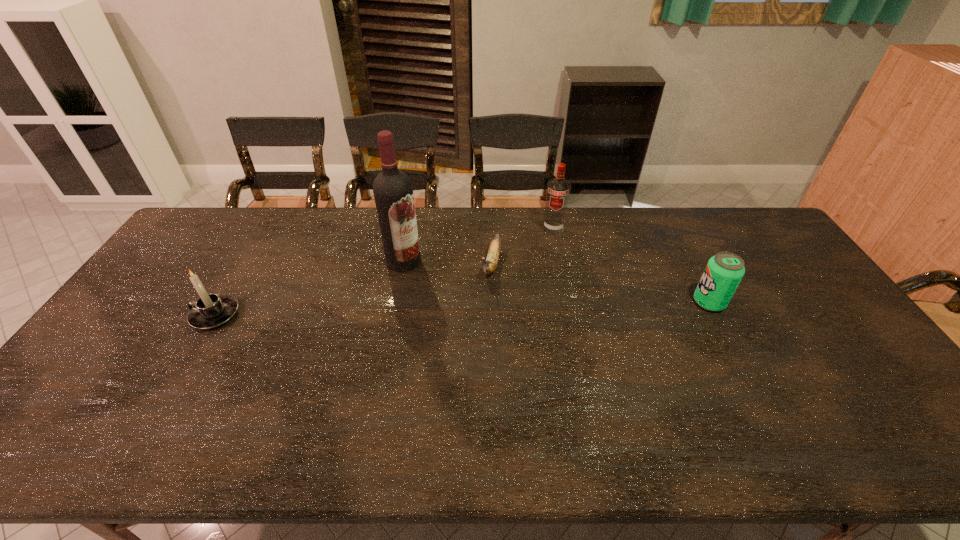
Where is `vacant point located 0.340m on the peel of the shortest object`? This screenshot has width=960, height=540. vacant point located 0.340m on the peel of the shortest object is located at coordinates (461, 372).

Find the location of `vacant region located 0.280m on the peel of the shortest object`. vacant region located 0.280m on the peel of the shortest object is located at coordinates pos(467,354).

The height and width of the screenshot is (540, 960). Find the location of `vacant space located 0.260m on the peel of the shortest object`. vacant space located 0.260m on the peel of the shortest object is located at coordinates (468, 348).

Find the location of a particular element. This screenshot has width=960, height=540. vodka positioned at the far edge is located at coordinates (558, 189).

Where is `banana positioned at the far edge`? This screenshot has width=960, height=540. banana positioned at the far edge is located at coordinates (489, 266).

Locate an element on the screen. The width and height of the screenshot is (960, 540). vacant region at the far edge of the desktop is located at coordinates (444, 242).

The image size is (960, 540). In the image, there is a desktop. What are the coordinates of `blank space at the near edge` in the screenshot? It's located at (250, 412).

Locate an element on the screen. free space at the far left corner of the desktop is located at coordinates (212, 207).

Identify the location of free spot between the banana and the rightmost object. The width and height of the screenshot is (960, 540). (600, 283).

This screenshot has height=540, width=960. In order to click on blank region between the banana and the candle holder in this screenshot , I will do `click(353, 289)`.